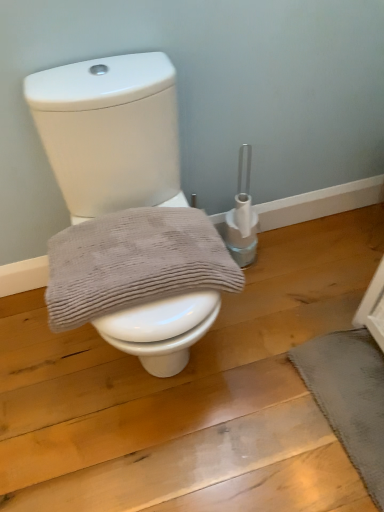
Question: From a real-world perspective, is white glossy toilet at center on gray textured towel at center?

Choices:
 (A) no
 (B) yes

Answer: (A)

Question: Is white glossy toilet at center at the right side of gray textured towel at center?

Choices:
 (A) no
 (B) yes

Answer: (B)

Question: Is white glossy toilet at center not close to gray textured towel at center?

Choices:
 (A) yes
 (B) no

Answer: (B)

Question: Is gray textured towel at center at the back of white glossy toilet at center?

Choices:
 (A) yes
 (B) no

Answer: (A)

Question: Is white glossy toilet at center taller than gray textured towel at center?

Choices:
 (A) no
 (B) yes

Answer: (B)

Question: Is white glossy toilet at center bigger than gray textured towel at center?

Choices:
 (A) no
 (B) yes

Answer: (B)

Question: Considering the relative sizes of white glossy toilet at center and dark gray textured bath mat at lower right in the image provided, is white glossy toilet at center thinner than dark gray textured bath mat at lower right?

Choices:
 (A) no
 (B) yes

Answer: (A)

Question: Considering the relative sizes of white glossy toilet at center and dark gray textured bath mat at lower right in the image provided, is white glossy toilet at center bigger than dark gray textured bath mat at lower right?

Choices:
 (A) yes
 (B) no

Answer: (A)

Question: Is white glossy toilet at center not close to dark gray textured bath mat at lower right?

Choices:
 (A) yes
 (B) no

Answer: (B)

Question: Is white glossy toilet at center facing towards dark gray textured bath mat at lower right?

Choices:
 (A) yes
 (B) no

Answer: (B)

Question: Would you say white glossy toilet at center is outside dark gray textured bath mat at lower right?

Choices:
 (A) no
 (B) yes

Answer: (B)

Question: From the image's perspective, is white glossy toilet at center located beneath dark gray textured bath mat at lower right?

Choices:
 (A) yes
 (B) no

Answer: (B)

Question: Is dark gray textured bath mat at lower right not close to gray textured towel at center?

Choices:
 (A) yes
 (B) no

Answer: (B)